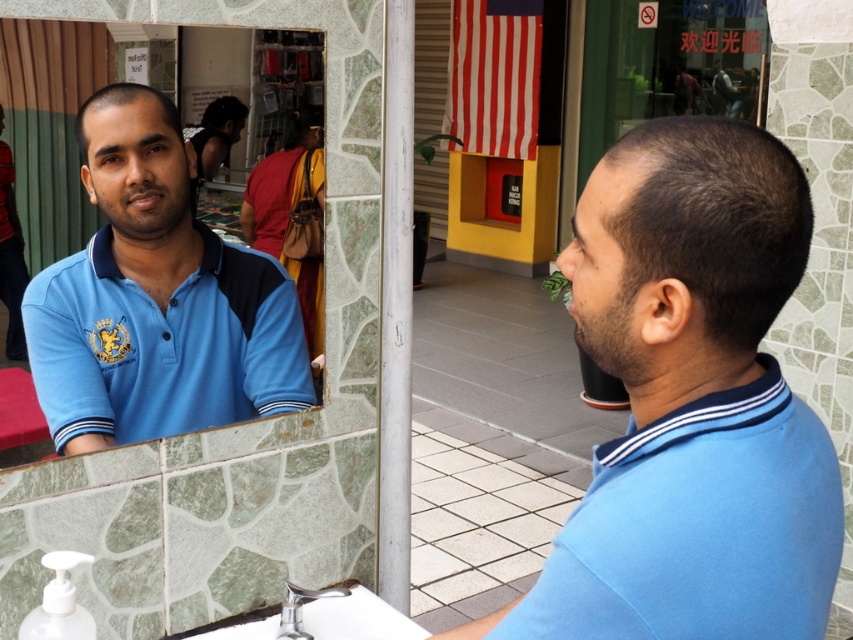
Question: Which point is farther from the camera taking this photo?

Choices:
 (A) (704, 204)
 (B) (225, 346)

Answer: (B)

Question: Which point appears farthest from the camera in this image?

Choices:
 (A) (190, 364)
 (B) (625, 572)
 (C) (231, 634)
 (D) (820, 568)

Answer: (C)

Question: From the image, what is the correct spatial relationship of matte blue polo shirt at right in relation to silver metallic faucet at lower center?

Choices:
 (A) left
 (B) right

Answer: (B)

Question: Does matte blue polo shirt at right have a larger size compared to chrome metallic faucet at lower center?

Choices:
 (A) no
 (B) yes

Answer: (B)

Question: Is blue matte shirt at left positioned at the back of chrome metallic faucet at lower center?

Choices:
 (A) no
 (B) yes

Answer: (A)

Question: Among these objects, which one is farthest from the camera?

Choices:
 (A) blue cotton shirt at center
 (B) silver metallic faucet at lower center
 (C) matte blue polo shirt at right
 (D) chrome metallic faucet at lower center

Answer: (B)